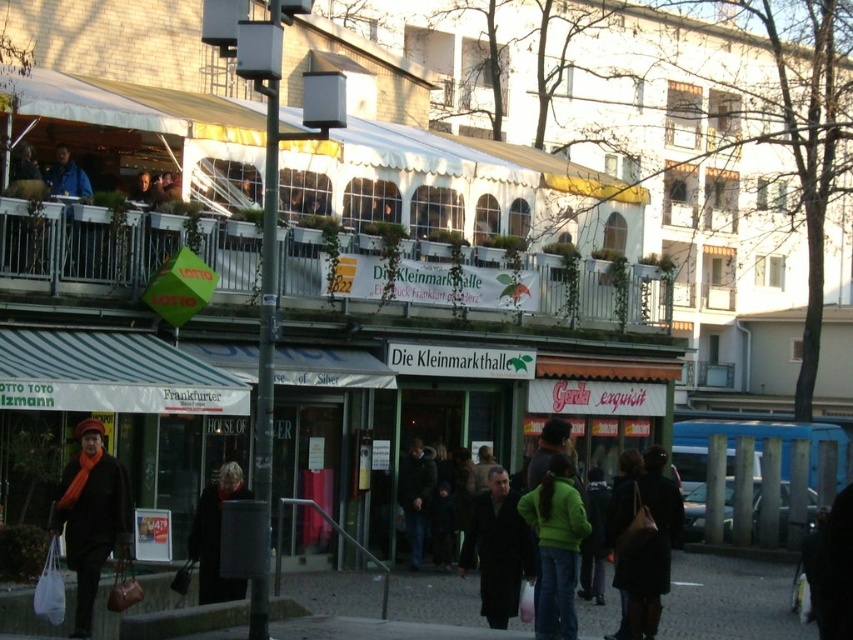
You are a photographer standing in front of the market hall. You notice a matte black coat at lower left and a dark brown leather bag at lower right in your viewfinder. Which object is positioned higher in the frame?

The matte black coat at lower left is located above the dark brown leather bag at lower right, so it is positioned higher in the frame.

You are a photographer standing at the entrance of Die Kleinmarkthalle in Frankfurt. You notice a matte black coat at lower left and a dark brown leather bag at lower right. Which object is wider?

The matte black coat at lower left is wider than the dark brown leather bag at lower right.